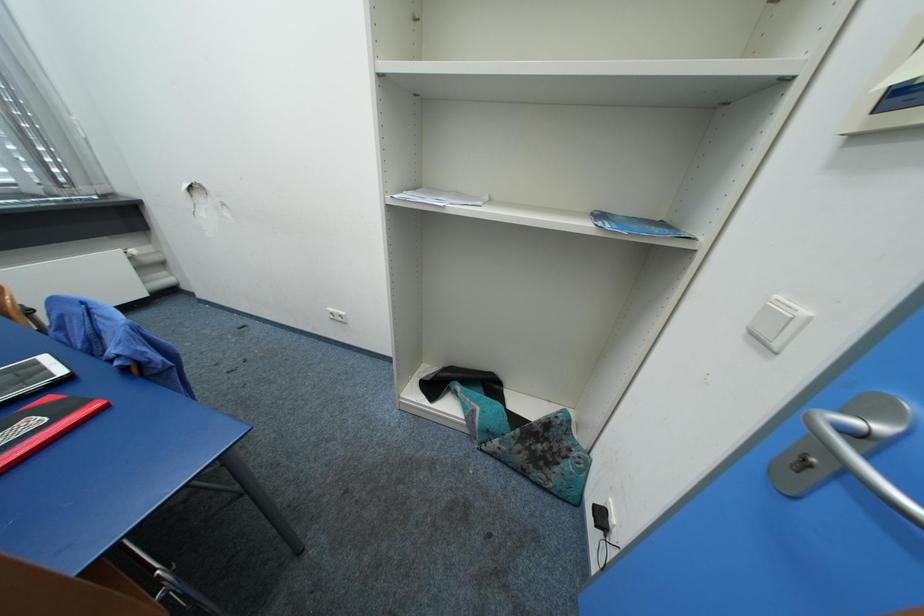
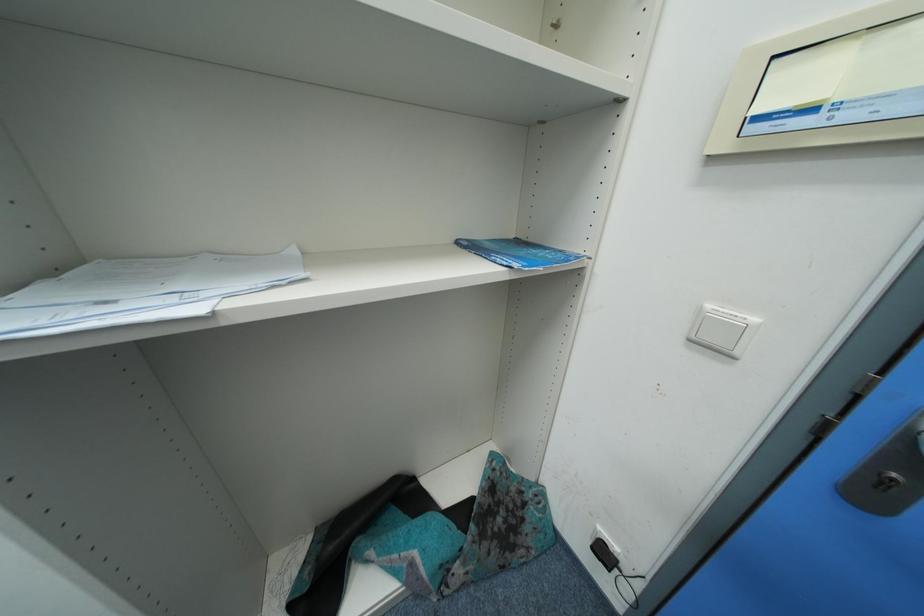
Question: The camera is either moving clockwise (left) or counter-clockwise (right) around the object. The first image is from the beginning of the video and the second image is from the end. Is the camera moving left or right when shooting the video?

Choices:
 (A) Left
 (B) Right

Answer: (A)